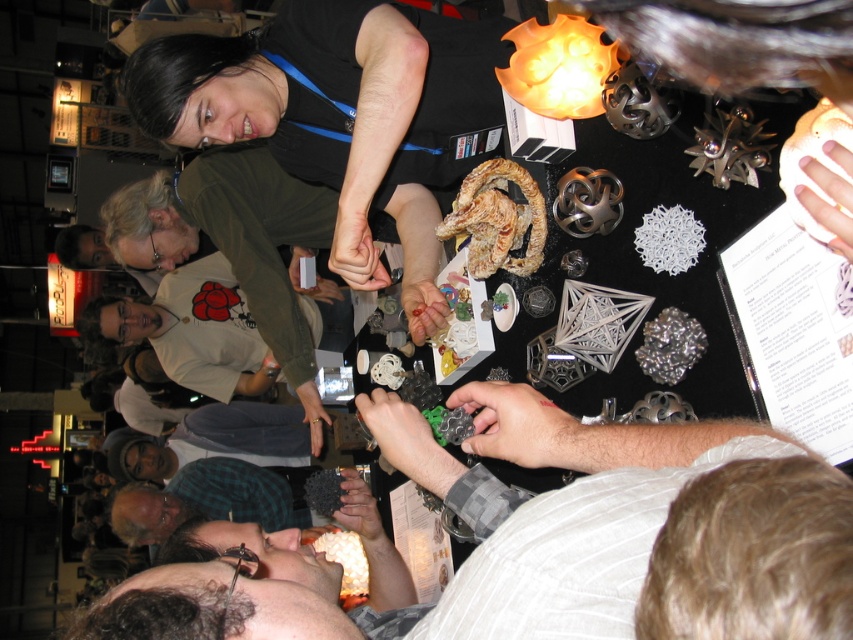
Question: Is gray fabric shirt at center smaller than green plaid shirt at lower center?

Choices:
 (A) no
 (B) yes

Answer: (B)

Question: Can you confirm if gray fabric shirt at center is bigger than green plaid shirt at lower center?

Choices:
 (A) no
 (B) yes

Answer: (A)

Question: Among these objects, which one is farthest from the camera?

Choices:
 (A) gray fabric shirt at center
 (B) green plaid shirt at lower center

Answer: (B)

Question: Does gray fabric shirt at center have a larger size compared to green plaid shirt at lower center?

Choices:
 (A) no
 (B) yes

Answer: (A)

Question: Which object is closer to the camera taking this photo?

Choices:
 (A) green plaid shirt at lower center
 (B) gray fabric shirt at center

Answer: (B)